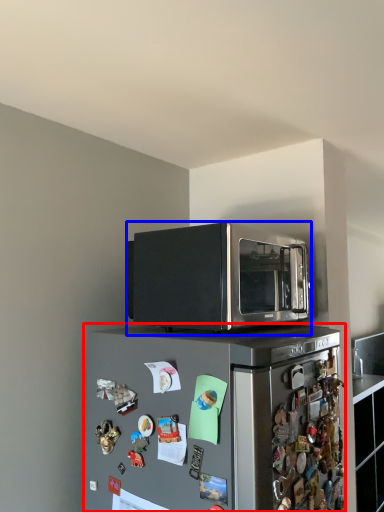
Question: Which of the following is the farthest to the observer, refrigerator (highlighted by a red box) or microwave oven (highlighted by a blue box)?

Choices:
 (A) refrigerator
 (B) microwave oven

Answer: (B)